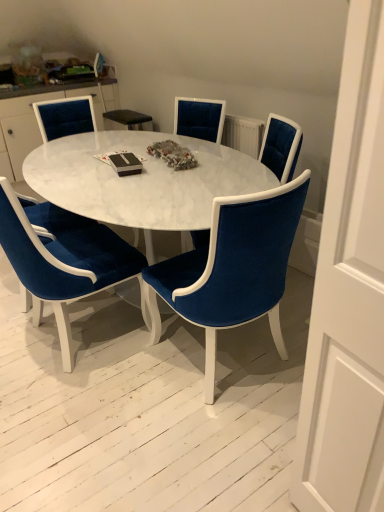
Where is `free space in front of velvet blue chair at center, the fourth chair when ordered from right to left`? This screenshot has height=512, width=384. free space in front of velvet blue chair at center, the fourth chair when ordered from right to left is located at coordinates (76, 410).